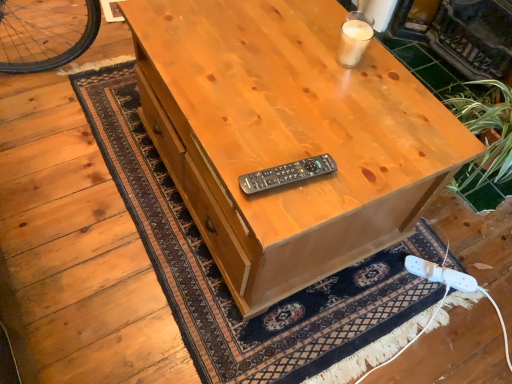
This screenshot has height=384, width=512. In order to click on free spot to the left of white plastic game controller at lower right in this screenshot , I will do `click(395, 281)`.